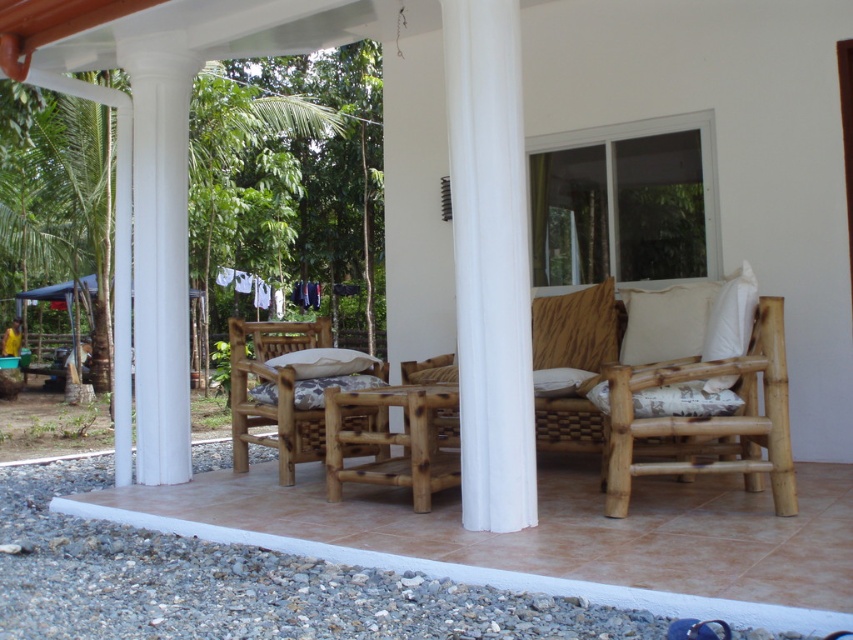
Question: Is white soft cushion at right behind white soft cushion at center?

Choices:
 (A) yes
 (B) no

Answer: (B)

Question: Which point is closer to the camera?

Choices:
 (A) white soft cushion at center
 (B) white soft cushion at right
 (C) white textured pillow at center

Answer: (C)

Question: Which object is closer to the camera taking this photo?

Choices:
 (A) natural wood rocking chair at center
 (B) white smooth column at center
 (C) brown bamboo porch at lower left
 (D) white soft cushion at right

Answer: (C)

Question: Can you confirm if white soft cushion at right is positioned to the left of white soft cushion at center?

Choices:
 (A) yes
 (B) no

Answer: (B)

Question: Which object appears closest to the camera in this image?

Choices:
 (A) white smooth column at center
 (B) white textured pillow at center
 (C) natural wood rocking chair at center

Answer: (A)

Question: Is white smooth column at center to the right of white soft cushion at center from the viewer's perspective?

Choices:
 (A) no
 (B) yes

Answer: (B)